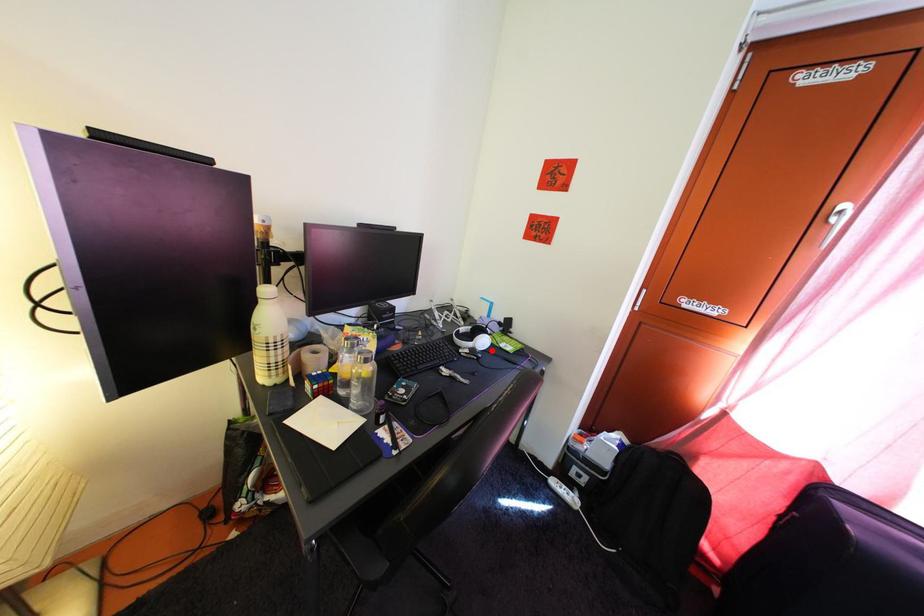
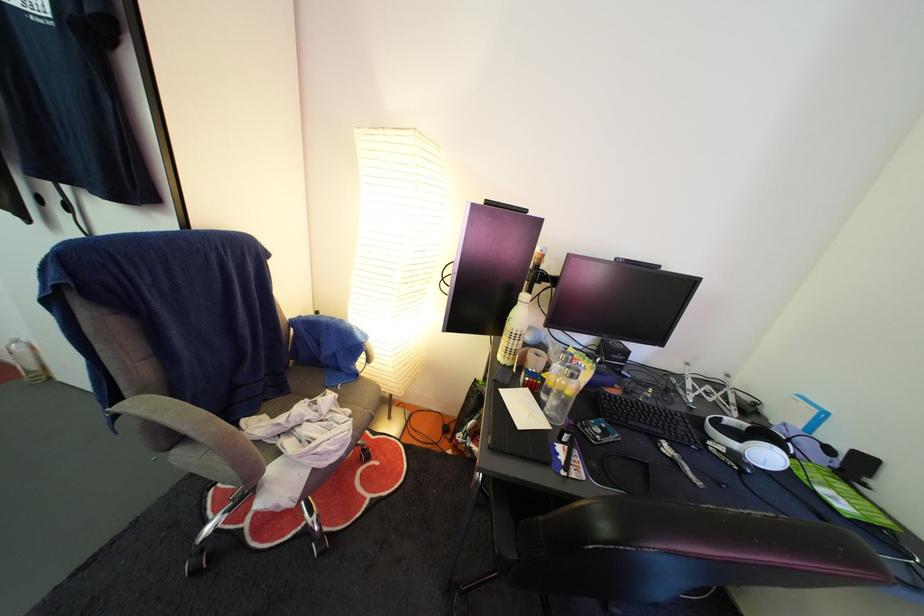
Question: I am providing you with two images of the same scene from different viewpoints. A red point is marked on the first image. At the location where the point appears in image 1, is it still visible in image 2?

Choices:
 (A) Yes
 (B) No

Answer: (A)